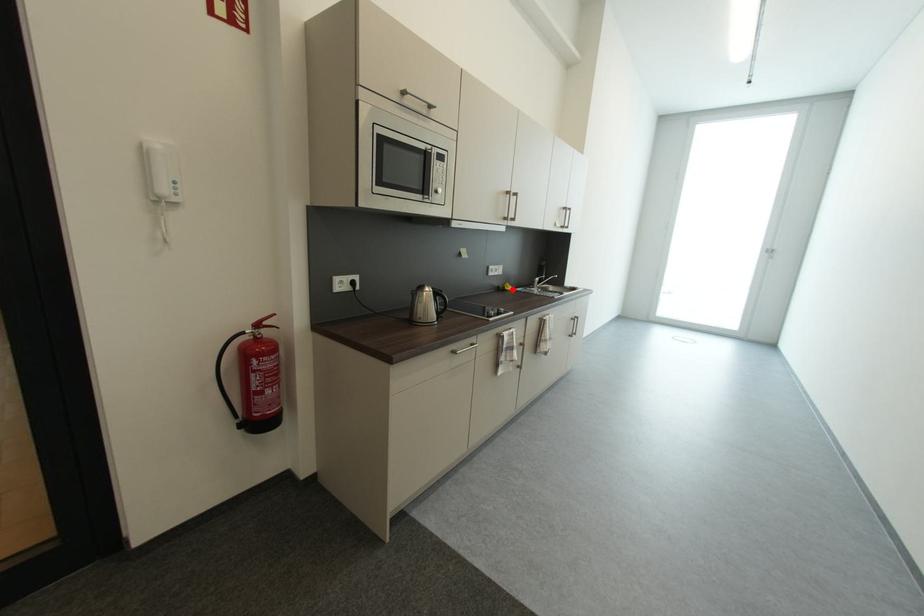
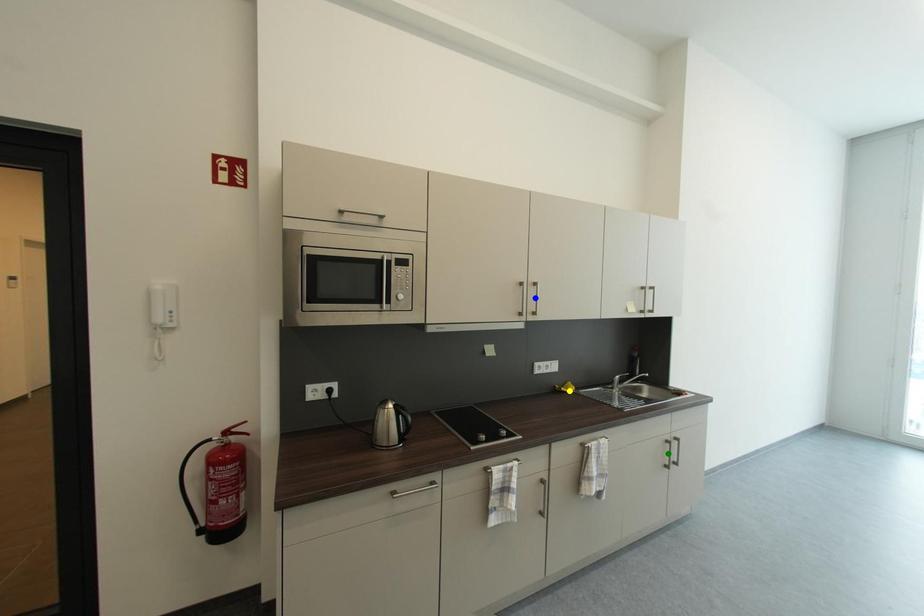
Question: I am providing you with two images of the same scene from different viewpoints. A red point is marked on the first image. You are given multiple points on the second image. Which spot in image 2 lines up with the point in image 1?

Choices:
 (A) green point
 (B) yellow point
 (C) blue point

Answer: (B)